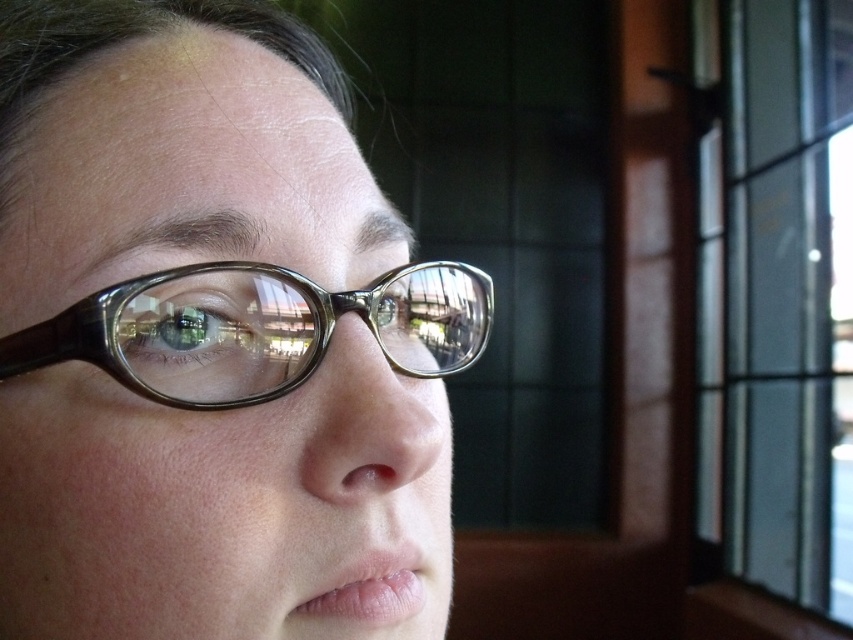
Question: Is transparent glass window at upper right thinner than translucent plastic glasses at center?

Choices:
 (A) yes
 (B) no

Answer: (B)

Question: Does transparent glass window at upper right appear on the right side of translucent plastic glasses at center?

Choices:
 (A) no
 (B) yes

Answer: (B)

Question: Which object is closer to the camera taking this photo?

Choices:
 (A) transparent plastic glasses at center
 (B) transparent glass window at upper right
 (C) translucent plastic glasses at center

Answer: (A)

Question: Does transparent plastic glasses at center appear under transparent glass window at upper right?

Choices:
 (A) no
 (B) yes

Answer: (B)

Question: Considering the real-world distances, which object is farthest from the translucent plastic glasses at center?

Choices:
 (A) transparent glass window at upper right
 (B) transparent plastic glasses at center

Answer: (A)

Question: Which of the following is the farthest from the observer?

Choices:
 (A) (196, 307)
 (B) (840, 266)

Answer: (B)